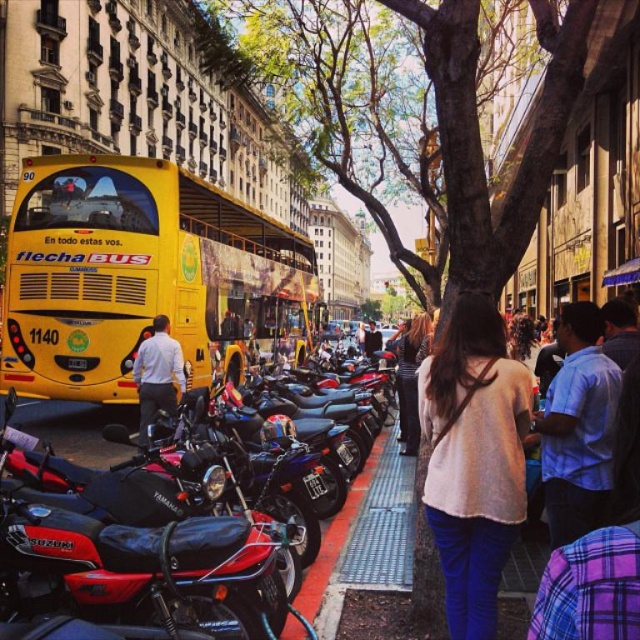
Does blue plaid shirt at center right have a greater width compared to white shirt at center?

Yes.

Who is taller, blue plaid shirt at center right or white shirt at center?

With more height is blue plaid shirt at center right.

Is point (563, 372) closer to camera compared to point (152, 416)?

Yes, it is in front of point (152, 416).

Locate an element on the screen. This screenshot has width=640, height=640. blue plaid shirt at center right is located at coordinates (579, 428).

Which is more to the left, light beige sweater at center or shiny black dress at center?

From the viewer's perspective, shiny black dress at center appears more on the left side.

You are a GUI agent. You are given a task and a screenshot of the screen. Output one action in this format:
    pyautogui.click(x=<x>, y=<y>)
    Task: Click on the light beige sweater at center
    This screenshot has height=640, width=640.
    Given the screenshot: What is the action you would take?
    pyautogui.click(x=474, y=460)

Measure the distance between yellow matte bus at center and white shirt at center.

yellow matte bus at center is 32.83 feet from white shirt at center.

Which is below, yellow matte bus at center or white shirt at center?

white shirt at center is lower down.

Who is more forward, (218, 289) or (170, 340)?

Point (170, 340) is more forward.

Find the location of a particular element. yellow matte bus at center is located at coordinates click(x=141, y=276).